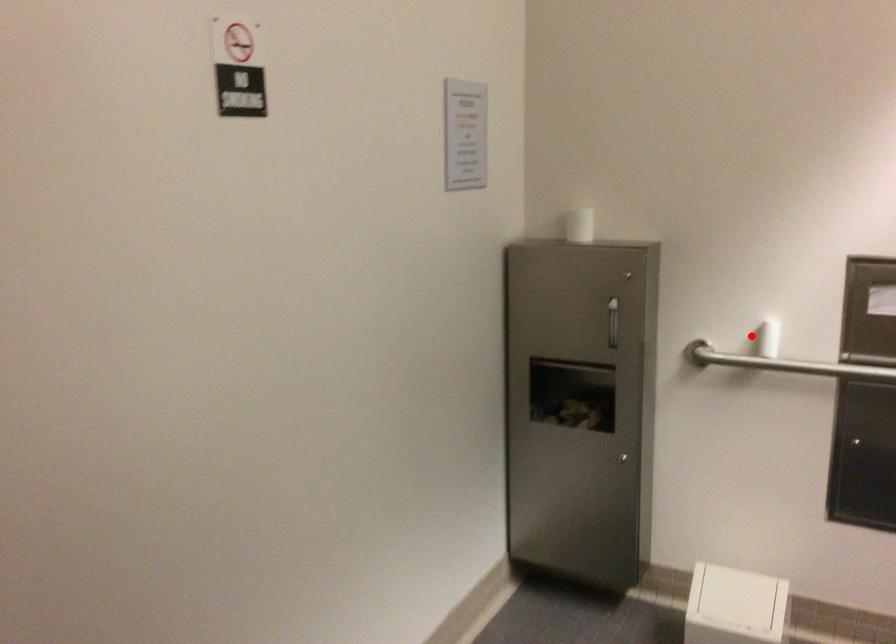
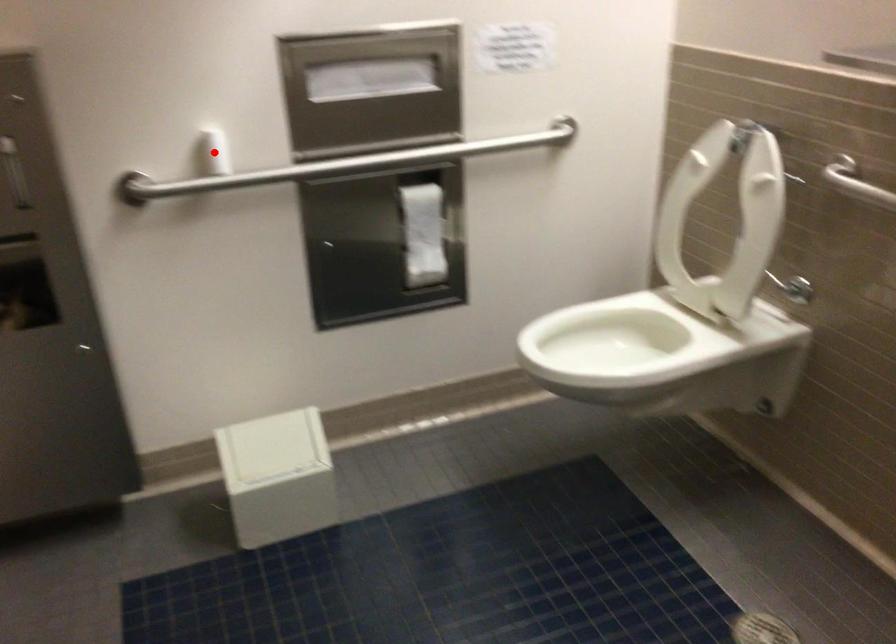
I am providing you with two images of the same scene from different viewpoints. A red point is marked on the first image and another point is marked on the second image. Is the marked point in image1 the same physical position as the marked point in image2?

Yes